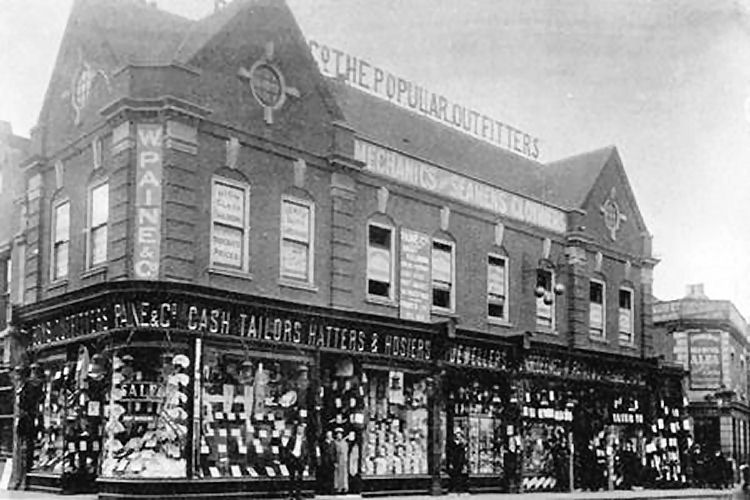
Where is `glass`? The height and width of the screenshot is (500, 750). glass is located at coordinates (274, 81).